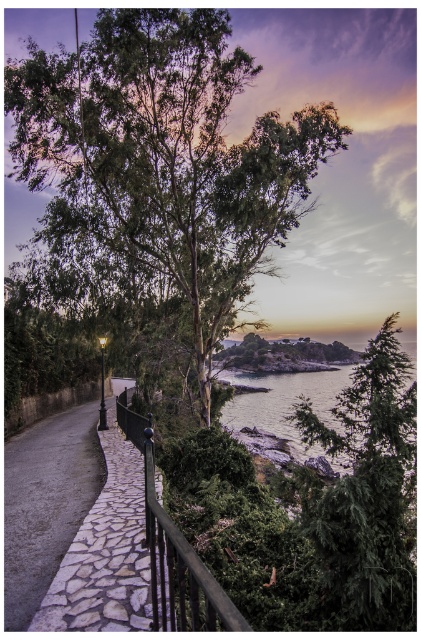
Does point (370, 465) come behind point (21, 596)?

Yes, point (370, 465) is behind point (21, 596).

Between point (405, 468) and point (32, 604), which one is positioned in front?

Point (32, 604) is more forward.

Where is `green textured tree at right`? green textured tree at right is located at coordinates (368, 492).

What do you see at coordinates (167, 156) in the screenshot? The image size is (421, 640). I see `green leafy tree at center` at bounding box center [167, 156].

Which is below, green leafy tree at center or black metal rail at center?

Positioned lower is black metal rail at center.

Does point (124, 240) come farther from viewer compared to point (175, 624)?

Yes, point (124, 240) is behind point (175, 624).

I want to click on green leafy tree at center, so click(167, 156).

Does green textured tree at right have a lesser height compared to black metal rail at center?

Incorrect, green textured tree at right's height does not fall short of black metal rail at center's.

Who is positioned more to the right, green textured tree at right or black metal rail at center?

green textured tree at right is more to the right.

The width and height of the screenshot is (421, 640). I want to click on green textured tree at right, so click(368, 492).